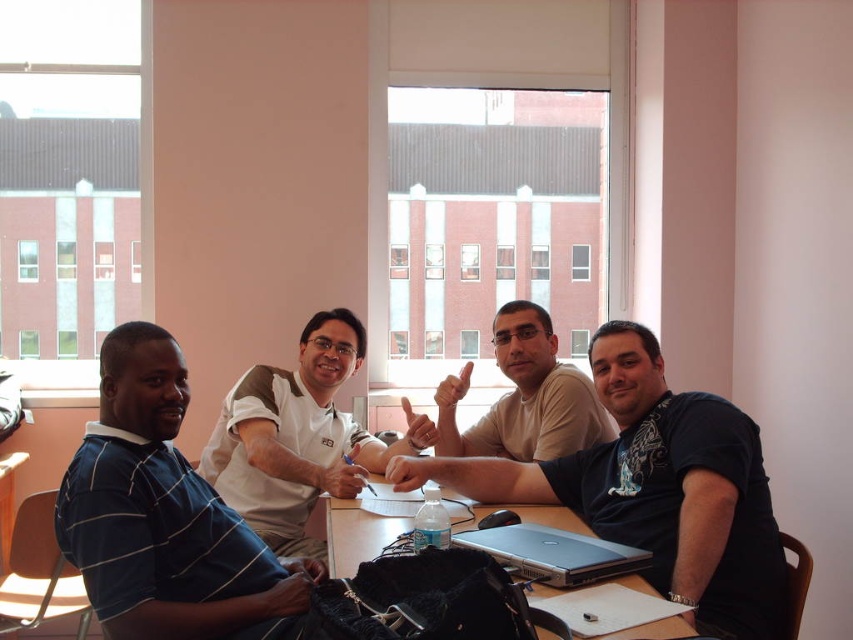
Which is more to the left, dark blue t-shirt at center or silver metallic table at center?

silver metallic table at center

How much distance is there between dark blue t-shirt at center and silver metallic table at center?

A distance of 10.18 inches exists between dark blue t-shirt at center and silver metallic table at center.

Is point (608, 381) more distant than point (366, 557)?

Yes.

Find the location of a particular element. This screenshot has height=640, width=853. dark blue t-shirt at center is located at coordinates (654, 490).

Can you confirm if blue striped shirt at left is positioned to the left of silver metallic table at center?

Yes, blue striped shirt at left is to the left of silver metallic table at center.

Is point (117, 481) positioned behind point (357, 518)?

That is False.

Where is `blue striped shirt at left`? The image size is (853, 640). blue striped shirt at left is located at coordinates (164, 515).

Is point (682, 554) positioned after point (517, 368)?

No.

Is dark blue t-shirt at center wider than light beige shirt at center?

Indeed, dark blue t-shirt at center has a greater width compared to light beige shirt at center.

Describe the element at coordinates (654, 490) in the screenshot. Image resolution: width=853 pixels, height=640 pixels. I see `dark blue t-shirt at center` at that location.

Image resolution: width=853 pixels, height=640 pixels. I want to click on dark blue t-shirt at center, so click(x=654, y=490).